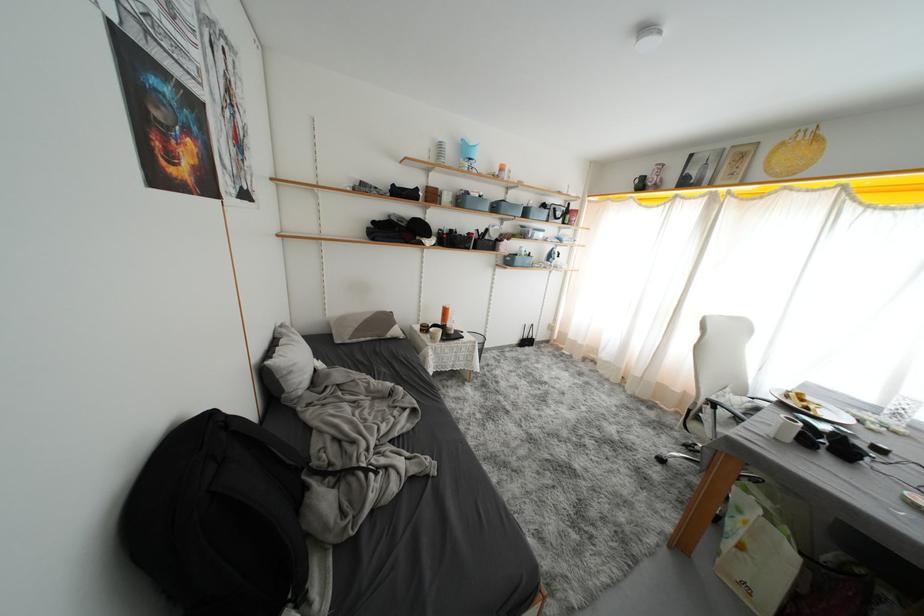
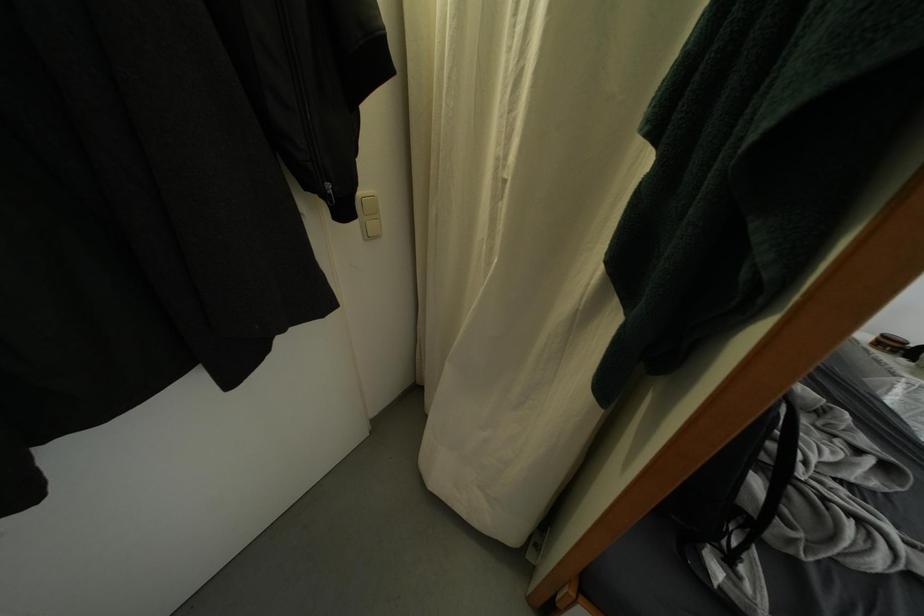
The point at (x=428, y=334) is marked in the first image. Where is the corresponding point in the second image?

(884, 347)